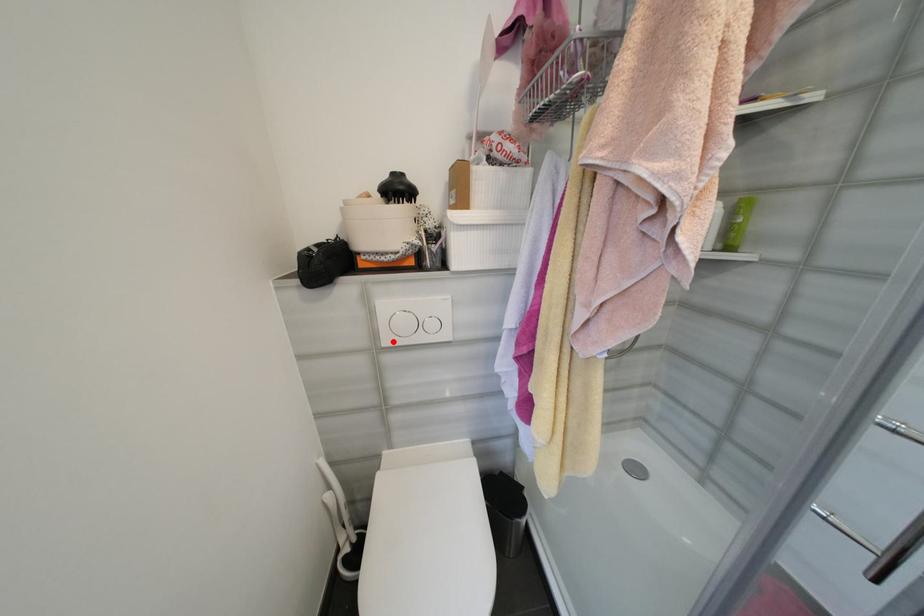
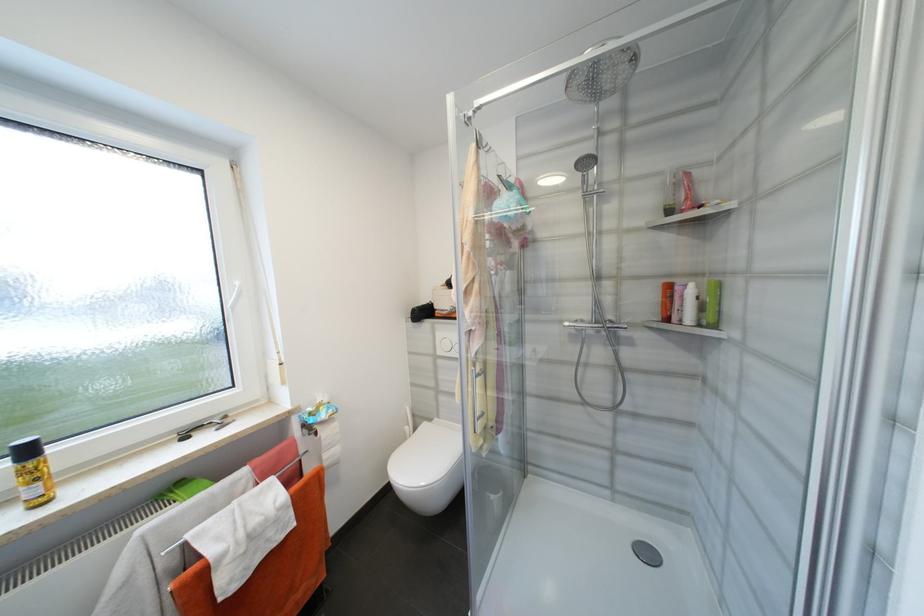
In the second image, find the point that corresponds to the highlighted location in the first image.

(445, 353)